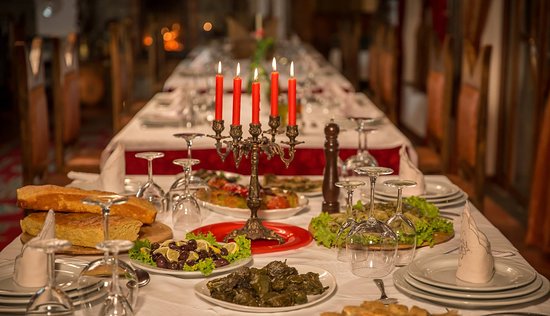
You are a GUI agent. You are given a task and a screenshot of the screen. Output one action in this format:
    pyautogui.click(x=<x>, y=<y>)
    Task: Click on the red candle
    The image size is (550, 316).
    Given the screenshot: What is the action you would take?
    pyautogui.click(x=218, y=103)